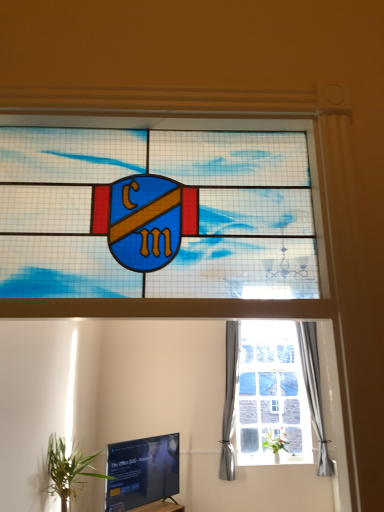
Question: Which direction should I rotate to look at green leafy plant at center, the first houseplant in the right-to-left sequence, — up or down?

Choices:
 (A) down
 (B) up

Answer: (A)

Question: Can you confirm if green leafy plant at center, arranged as the 2th houseplant when viewed from the front, is bigger than black glossy tv at lower left?

Choices:
 (A) no
 (B) yes

Answer: (A)

Question: Is green leafy plant at center, acting as the 1th houseplant starting from the bottom, at the left side of black glossy tv at lower left?

Choices:
 (A) no
 (B) yes

Answer: (A)

Question: Are green leafy plant at center, acting as the 1th houseplant starting from the bottom, and black glossy tv at lower left beside each other?

Choices:
 (A) no
 (B) yes

Answer: (A)

Question: Does green leafy plant at center, which ranks as the first houseplant in back-to-front order, have a lesser width compared to black glossy tv at lower left?

Choices:
 (A) no
 (B) yes

Answer: (A)

Question: Is green leafy plant at center, placed as the 2th houseplant when sorted from top to bottom, to the right of black glossy tv at lower left from the viewer's perspective?

Choices:
 (A) no
 (B) yes

Answer: (B)

Question: From a real-world perspective, is green leafy plant at center, acting as the 1th houseplant starting from the bottom, located higher than black glossy tv at lower left?

Choices:
 (A) no
 (B) yes

Answer: (B)

Question: From a real-world perspective, is gray fabric curtain at right, which appears as the 2th curtain when viewed from the right, positioned under green leafy plant at lower left, which ranks as the 2th houseplant in right-to-left order, based on gravity?

Choices:
 (A) no
 (B) yes

Answer: (A)

Question: Considering the relative positions of gray fabric curtain at right, which appears as the 2th curtain when viewed from the right, and green leafy plant at lower left, the second houseplant when ordered from back to front, in the image provided, is gray fabric curtain at right, which appears as the 2th curtain when viewed from the right, to the right of green leafy plant at lower left, the second houseplant when ordered from back to front, from the viewer's perspective?

Choices:
 (A) no
 (B) yes

Answer: (B)

Question: Does gray fabric curtain at right, which appears as the 2th curtain when viewed from the right, contain green leafy plant at lower left, the second houseplant when ordered from back to front?

Choices:
 (A) yes
 (B) no

Answer: (B)

Question: Can you confirm if gray fabric curtain at right, which ranks as the first curtain in left-to-right order, is thinner than green leafy plant at lower left, the 2th houseplant from the bottom?

Choices:
 (A) yes
 (B) no

Answer: (A)

Question: Could you tell me if gray fabric curtain at right, which ranks as the first curtain in left-to-right order, is facing green leafy plant at lower left, which is the 1th houseplant in left-to-right order?

Choices:
 (A) no
 (B) yes

Answer: (A)

Question: From a real-world perspective, does gray fabric curtain at right, which ranks as the first curtain in left-to-right order, stand above green leafy plant at lower left, the second houseplant when ordered from back to front?

Choices:
 (A) yes
 (B) no

Answer: (A)

Question: Considering the relative positions of black glossy tv at lower left and gray fabric curtain at right, which appears as the 2th curtain when viewed from the right, in the image provided, is black glossy tv at lower left to the left of gray fabric curtain at right, which appears as the 2th curtain when viewed from the right, from the viewer's perspective?

Choices:
 (A) yes
 (B) no

Answer: (A)